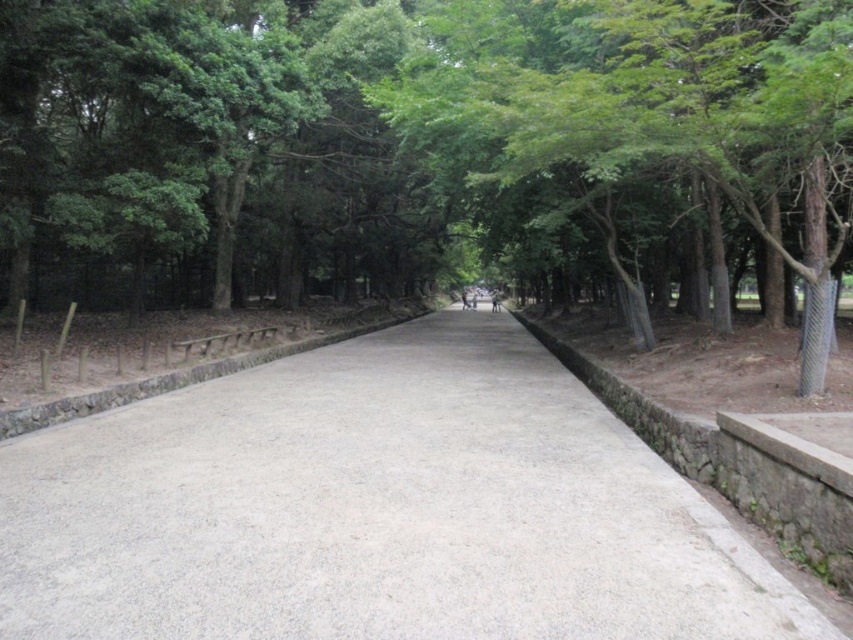
You are standing on the gray concrete pavement at center and want to walk towards the green leafy tree at center. Which direction should you face to move towards it?

You should face to the right because the green leafy tree at center is to the right of the gray concrete pavement at center.

You are standing at the start of the pathway and want to know which object is taller between the green leafy tree at center and the gray concrete pavement at center. Can you tell me?

The green leafy tree at center is much taller than the gray concrete pavement at center.

You are standing at the starting point of the pathway and want to reach the green leafy tree at center. Based on the coordinates provided, in which direction should you walk to find the tree?

The green leafy tree at center is located at coordinates point (412, 141), so you should walk towards the center of the pathway to reach it.